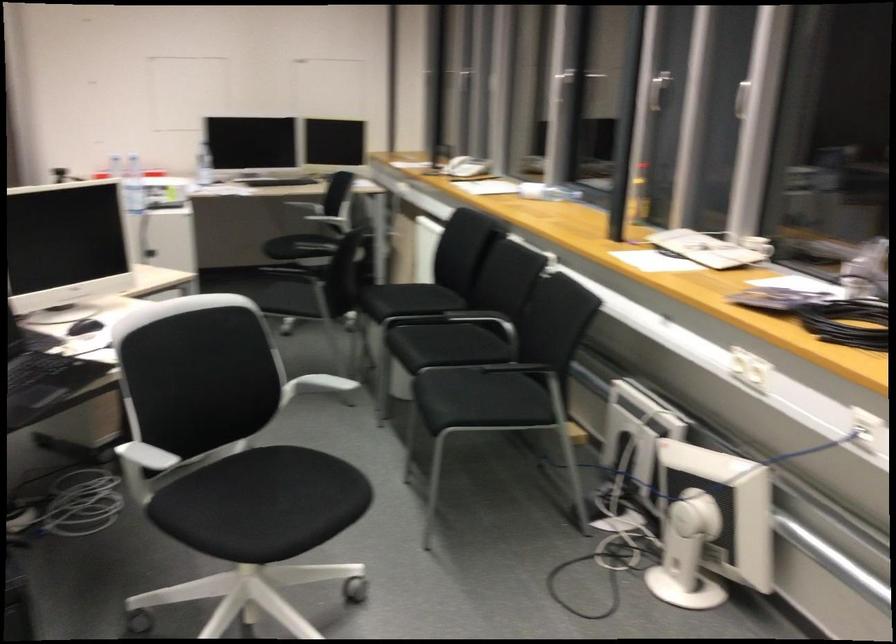
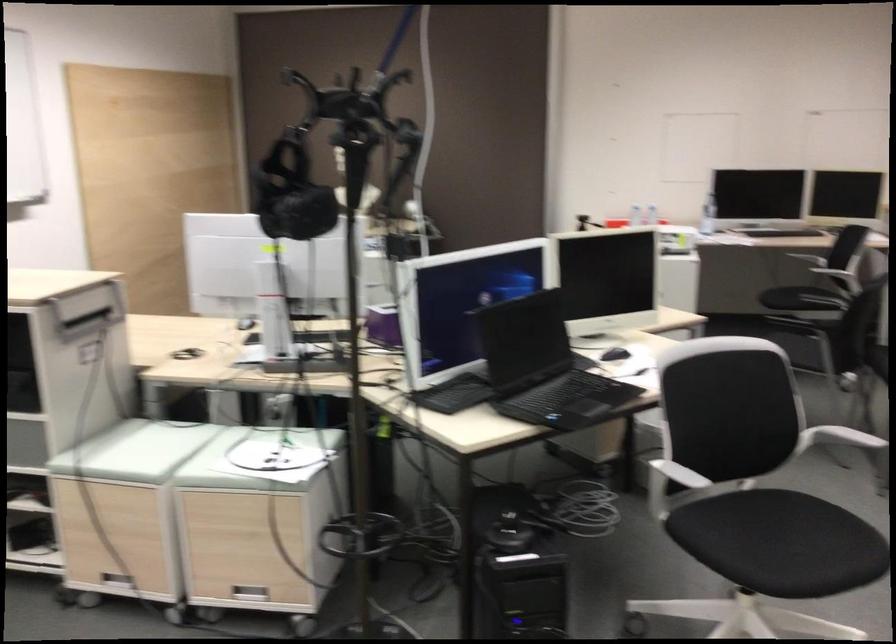
Locate, in the second image, the point that corresponds to (257,502) in the first image.

(780, 542)